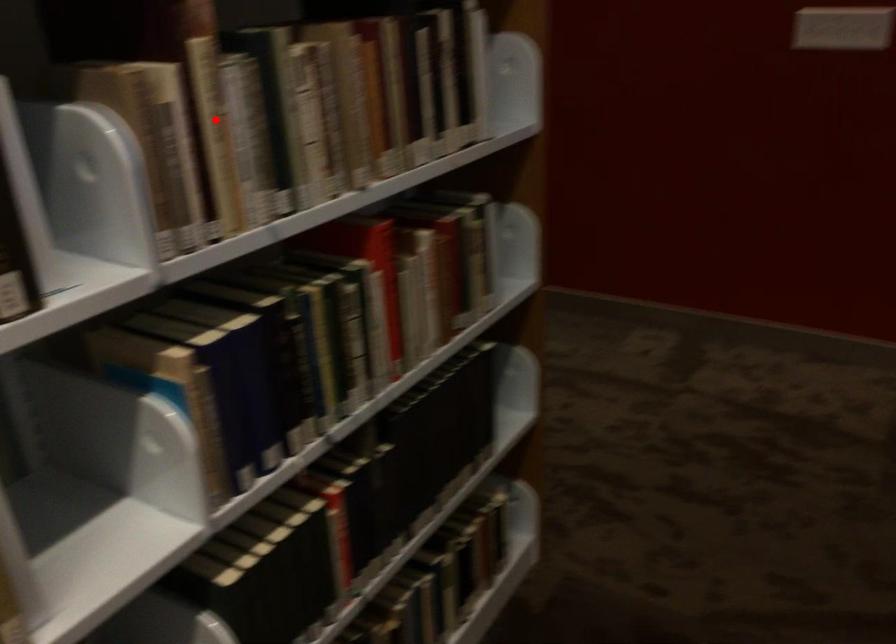
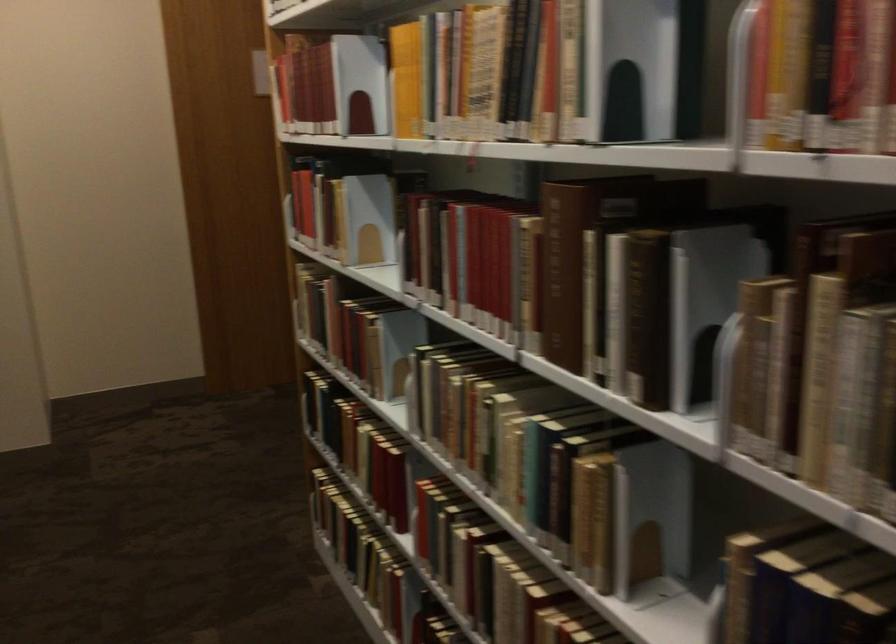
The point at the highlighted location is marked in the first image. Where is the corresponding point in the second image?

(817, 366)